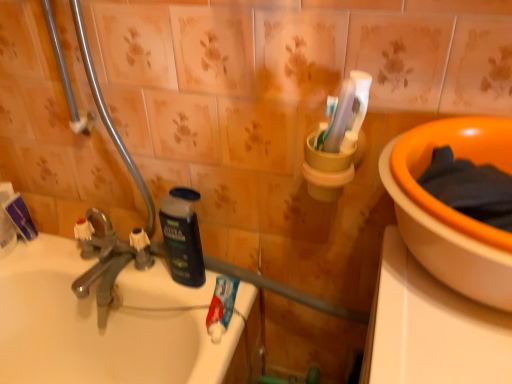
Question: Does white matte toothpaste at upper left, which is counted as the first toothpaste, starting from the left, lie in front of chrome metallic faucet at left?

Choices:
 (A) no
 (B) yes

Answer: (A)

Question: Is white matte toothpaste at upper left, which is the second toothpaste from bottom to top, to the left of chrome metallic faucet at left from the viewer's perspective?

Choices:
 (A) no
 (B) yes

Answer: (B)

Question: From the image's perspective, is white matte toothpaste at upper left, which ranks as the second toothpaste in front-to-back order, on chrome metallic faucet at left?

Choices:
 (A) yes
 (B) no

Answer: (A)

Question: Is white matte toothpaste at upper left, which ranks as the second toothpaste in front-to-back order, placed right next to chrome metallic faucet at left?

Choices:
 (A) yes
 (B) no

Answer: (B)

Question: Is white matte toothpaste at upper left, which is the second toothpaste from bottom to top, thinner than chrome metallic faucet at left?

Choices:
 (A) no
 (B) yes

Answer: (B)

Question: Does white matte toothpaste at upper left, the 1th toothpaste viewed from the top, lie behind chrome metallic faucet at left?

Choices:
 (A) yes
 (B) no

Answer: (A)

Question: Is white matte toothpaste at upper left, which is counted as the 2th toothpaste, starting from the right, turned away from orange ceramic basin at upper right?

Choices:
 (A) yes
 (B) no

Answer: (B)

Question: Considering the relative positions of white matte toothpaste at upper left, the first toothpaste when ordered from back to front, and orange ceramic basin at upper right in the image provided, is white matte toothpaste at upper left, the first toothpaste when ordered from back to front, to the right of orange ceramic basin at upper right from the viewer's perspective?

Choices:
 (A) yes
 (B) no

Answer: (B)

Question: Is white matte toothpaste at upper left, which is counted as the first toothpaste, starting from the left, located outside orange ceramic basin at upper right?

Choices:
 (A) yes
 (B) no

Answer: (A)

Question: Is white matte toothpaste at upper left, which is counted as the 2th toothpaste, starting from the right, positioned before orange ceramic basin at upper right?

Choices:
 (A) no
 (B) yes

Answer: (A)

Question: From the image's perspective, is white matte toothpaste at upper left, the first toothpaste when ordered from back to front, below orange ceramic basin at upper right?

Choices:
 (A) no
 (B) yes

Answer: (B)

Question: Considering the relative sizes of white matte toothpaste at upper left, which ranks as the second toothpaste in front-to-back order, and orange ceramic basin at upper right in the image provided, is white matte toothpaste at upper left, which ranks as the second toothpaste in front-to-back order, thinner than orange ceramic basin at upper right?

Choices:
 (A) yes
 (B) no

Answer: (A)

Question: Is white matte toothpaste at upper left, which is the second toothpaste from bottom to top, to the right of black matte bottle at center from the viewer's perspective?

Choices:
 (A) yes
 (B) no

Answer: (B)